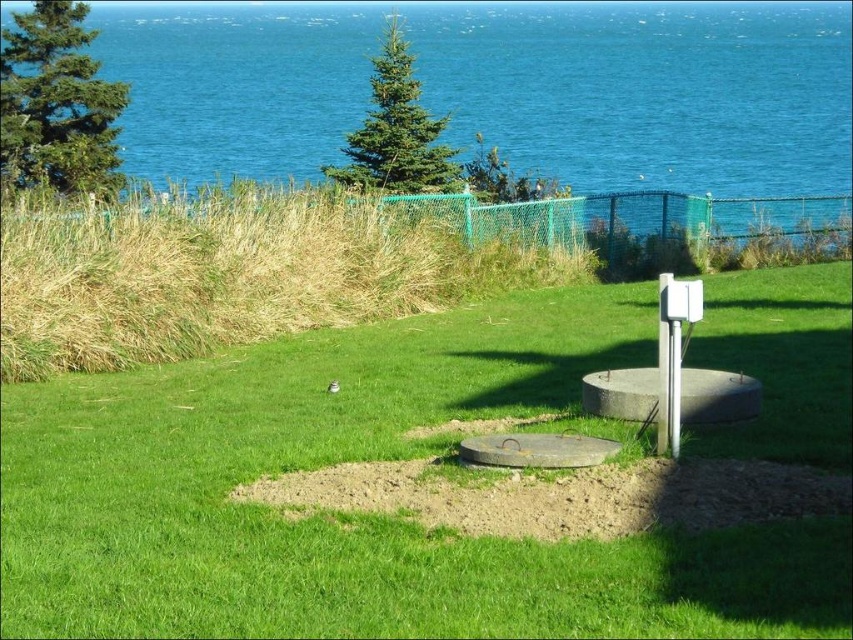
You are standing at the edge of the grassy area and want to place a 6 meter long bench. Can you place the bench so that it starts at your current position and extends towards the green grassy at center?

The distance from the viewer to the green grassy at center is 5.96 meters, which is slightly shorter than the 6 meter bench. Therefore, the bench cannot be placed as it would extend beyond the available space.

You are planning to set up a picnic area in the scene. Given that the green grassy at center and the blue water at upper center are both visible from your proposed location, which area would be more suitable for placing a large picnic blanket? Explain your choice based on their sizes.

The blue water at upper center has a larger size compared to the green grassy at center, making it more suitable for placing a large picnic blanket due to its greater space availability.